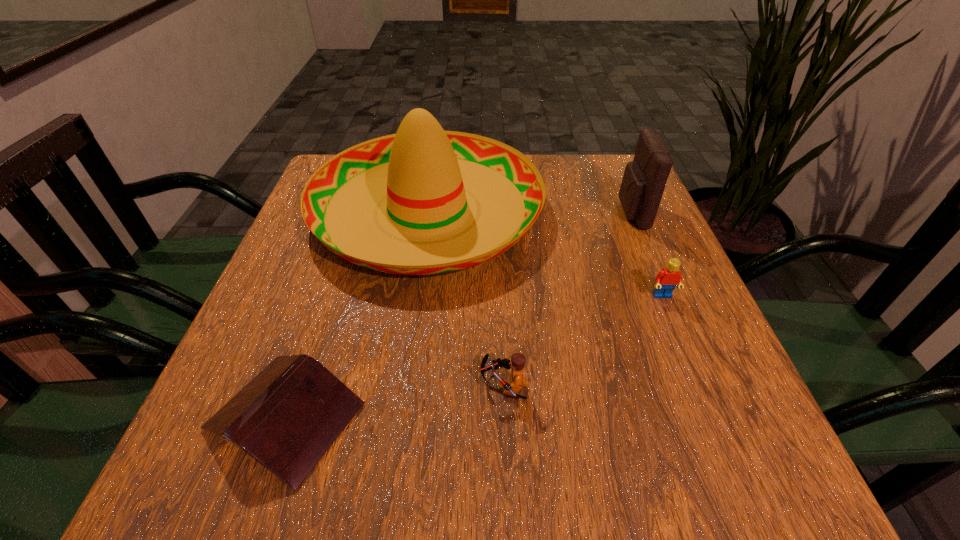
At what (x,y) coordinates should I click in order to perform the action: click on Lego situated at the right edge. Please return your answer as a coordinate pair (x, y). The height and width of the screenshot is (540, 960). Looking at the image, I should click on (666, 280).

Identify the location of object situated at the far left corner. pyautogui.click(x=422, y=172).

Find the location of a particular element. object that is at the near left corner is located at coordinates (287, 417).

This screenshot has height=540, width=960. What are the coordinates of `object that is at the far right corner` in the screenshot? It's located at (644, 180).

I want to click on blank space at the far edge of the desktop, so click(557, 192).

Where is `vacant space at the near edge of the desktop`? vacant space at the near edge of the desktop is located at coordinates (330, 467).

Identify the location of free space at the left edge of the desktop. (261, 347).

In the image, there is a desktop. Where is `vacant space at the right edge`? vacant space at the right edge is located at coordinates pyautogui.click(x=691, y=293).

The height and width of the screenshot is (540, 960). I want to click on free location at the far right corner, so click(x=590, y=185).

Identify the location of free space between the tallest object and the nearer Lego. (466, 298).